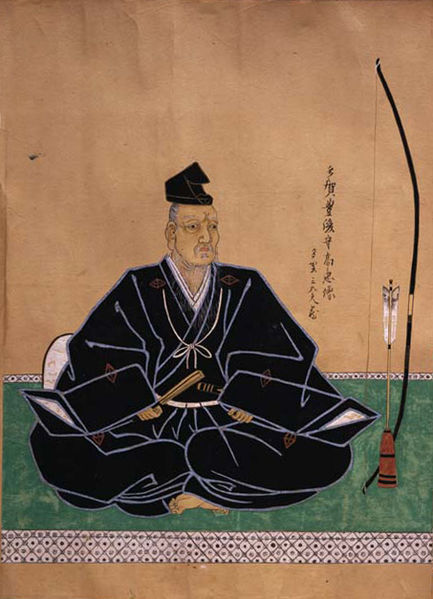
Find the location of `green floor`. green floor is located at coordinates (48, 513).